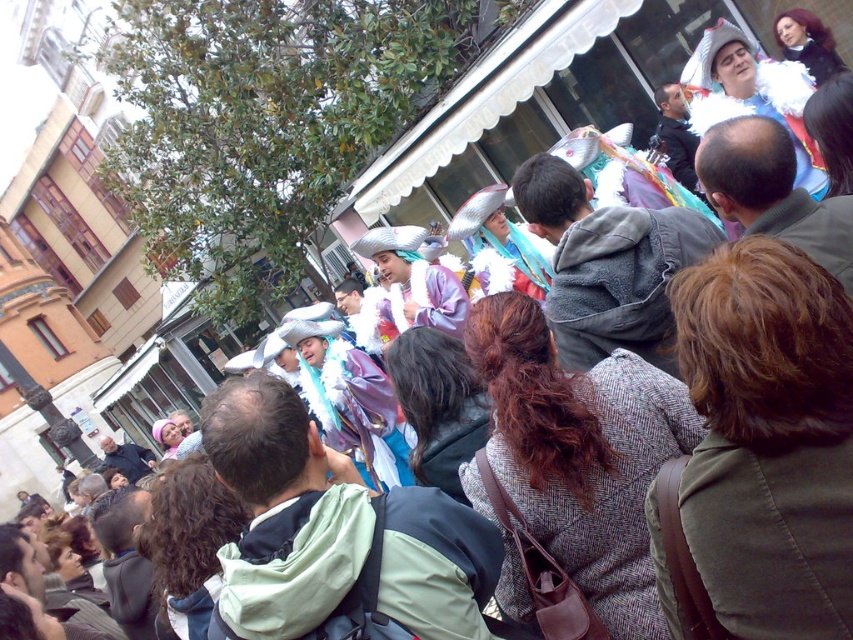
Between dark brown hair at center and white fluffy hat at upper right, which one is positioned lower?

dark brown hair at center is lower down.

Does dark brown hair at center appear over white fluffy hat at upper right?

Incorrect, dark brown hair at center is not positioned above white fluffy hat at upper right.

Locate an element on the screen. Image resolution: width=853 pixels, height=640 pixels. dark brown hair at center is located at coordinates (438, 404).

Can you confirm if dark brown hair at center is shorter than light brown hair at center?

In fact, dark brown hair at center may be taller than light brown hair at center.

Can you confirm if dark brown hair at center is smaller than light brown hair at center?

Indeed, dark brown hair at center has a smaller size compared to light brown hair at center.

Locate an element on the screen. dark brown hair at center is located at coordinates (438, 404).

Which is in front, point (177, 556) or point (817, 35)?

Positioned in front is point (177, 556).

Can you confirm if dark brown curly hair at center is positioned above shiny black hair at upper right?

No.

I want to click on dark brown curly hair at center, so click(x=189, y=541).